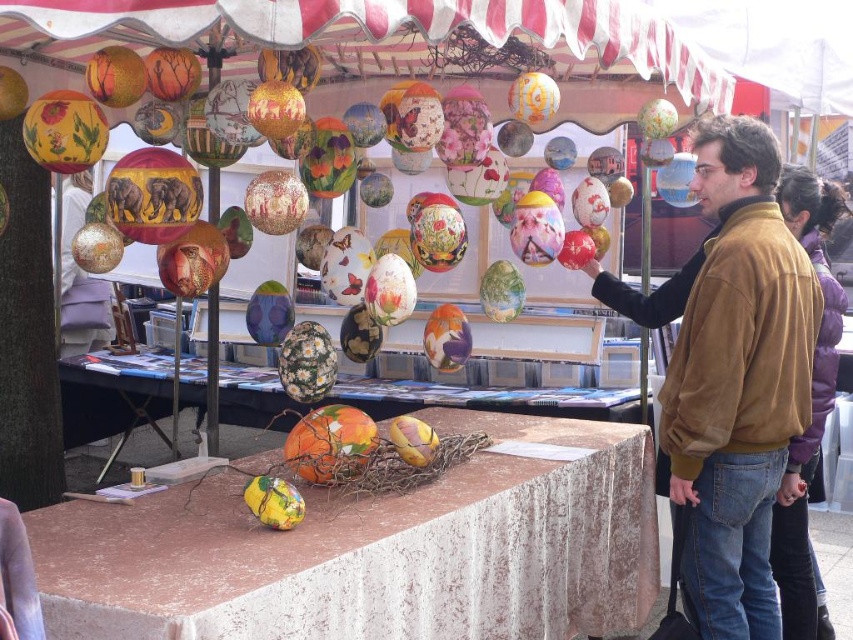
Question: Which point is closer to the camera taking this photo?

Choices:
 (A) (428, 620)
 (B) (525, 388)
 (C) (674, 348)

Answer: (A)

Question: Is brown suede jacket at upper right to the right of brown leather jacket at right from the viewer's perspective?

Choices:
 (A) no
 (B) yes

Answer: (A)

Question: Which object is positioned closest to the marble table at center?

Choices:
 (A) brown leather jacket at right
 (B) brown suede jacket at upper right
 (C) velvet-like beige tablecloth at lower center

Answer: (C)

Question: Does velvet-like beige tablecloth at lower center appear over brown suede jacket at upper right?

Choices:
 (A) no
 (B) yes

Answer: (A)

Question: Based on their relative distances, which object is farther from the velvet-like beige tablecloth at lower center?

Choices:
 (A) brown leather jacket at right
 (B) marble table at center
 (C) brown suede jacket at upper right

Answer: (B)

Question: Can you confirm if brown suede jacket at upper right is positioned above brown leather jacket at right?

Choices:
 (A) no
 (B) yes

Answer: (B)